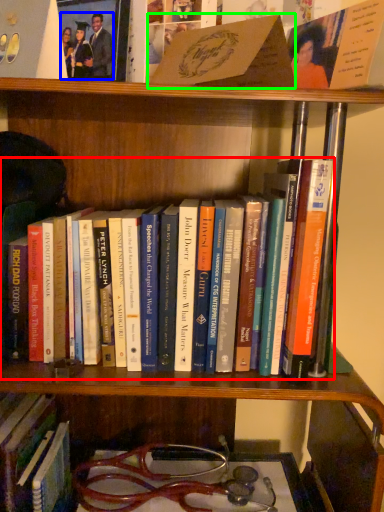
Question: Which object is the closest to the book (highlighted by a red box)? Choose among these: couple (highlighted by a blue box) or book (highlighted by a green box).

Choices:
 (A) couple
 (B) book

Answer: (B)